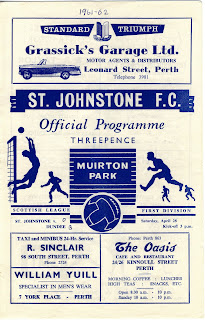
This screenshot has height=320, width=205. I want to click on window, so click(x=42, y=61).